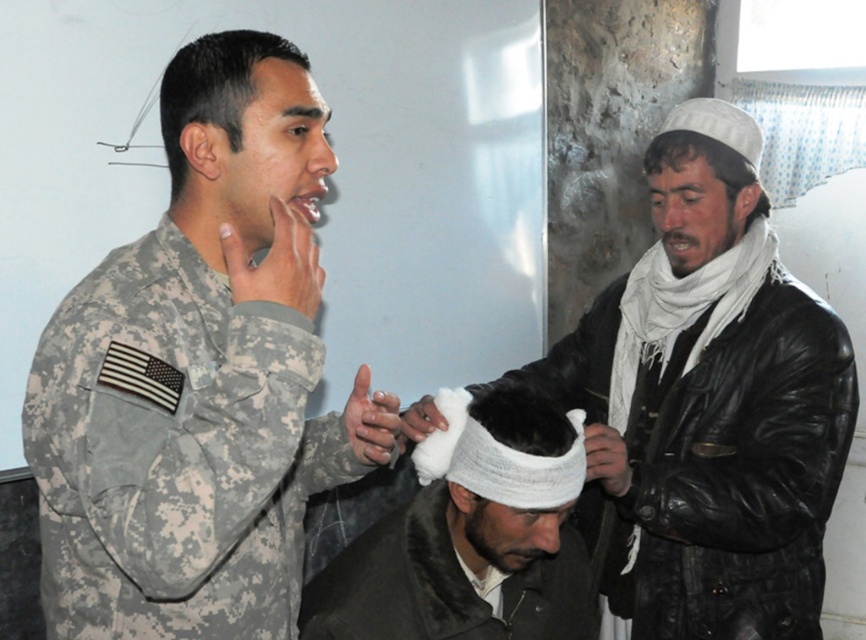
You are a medical professional standing next to the white bandage at center. The person in camouflage is 1.39 meters away from you. Can you safely reach them with a 1.5 meter medical tool without moving?

Yes, the distance between you and the person in camouflage is 1.39 meters, which is less than the 1.5 meter length of the tool. Therefore, you can safely reach them with the tool without needing to move.

You are a medical professional assessing the injuries of the individual in the center. The white bandaged head at center and the matte skin forehead at center are both visible. Which one has a greater width?

The white bandaged head at center is wider than the matte skin forehead at center according to the description.